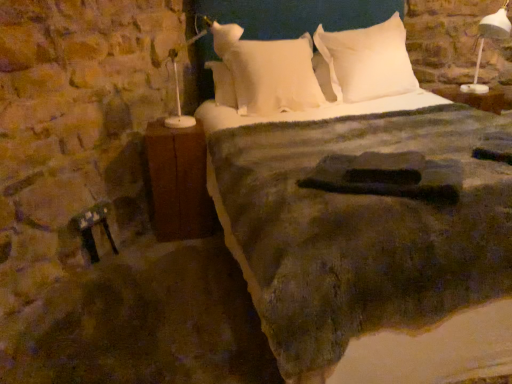
Question: Does white soft pillow at upper center, which is the 1th pillow in right-to-left order, have a greater width compared to white soft pillow at center, which is the 1th pillow in left-to-right order?

Choices:
 (A) yes
 (B) no

Answer: (B)

Question: Does white soft pillow at upper center, which is the 1th pillow in right-to-left order, lie in front of white soft pillow at center, which is the 1th pillow in left-to-right order?

Choices:
 (A) no
 (B) yes

Answer: (A)

Question: Is white soft pillow at upper center, the second pillow when ordered from left to right, next to white soft pillow at center, the 2th pillow positioned from the right?

Choices:
 (A) yes
 (B) no

Answer: (B)

Question: Is white soft pillow at upper center, the second pillow when ordered from left to right, facing towards white soft pillow at center, the 2th pillow positioned from the right?

Choices:
 (A) no
 (B) yes

Answer: (A)

Question: From the image's perspective, is white soft pillow at upper center, the second pillow when ordered from left to right, over white soft pillow at center, the 2th pillow positioned from the right?

Choices:
 (A) yes
 (B) no

Answer: (A)

Question: Considering the relative sizes of white soft pillow at upper center, the second pillow when ordered from left to right, and white soft pillow at center, the 2th pillow positioned from the right, in the image provided, is white soft pillow at upper center, the second pillow when ordered from left to right, taller than white soft pillow at center, the 2th pillow positioned from the right,?

Choices:
 (A) no
 (B) yes

Answer: (B)

Question: Does brown wood nightstand at left have a greater width compared to white plastic lamp at upper right?

Choices:
 (A) no
 (B) yes

Answer: (A)

Question: Does brown wood nightstand at left appear on the left side of white plastic lamp at upper right?

Choices:
 (A) no
 (B) yes

Answer: (B)

Question: Would you say brown wood nightstand at left contains white plastic lamp at upper right?

Choices:
 (A) no
 (B) yes

Answer: (A)

Question: Can you confirm if brown wood nightstand at left is thinner than white plastic lamp at upper right?

Choices:
 (A) no
 (B) yes

Answer: (B)

Question: Does brown wood nightstand at left come behind white plastic lamp at upper right?

Choices:
 (A) no
 (B) yes

Answer: (A)

Question: Is brown wood nightstand at left taller than white plastic lamp at upper right?

Choices:
 (A) no
 (B) yes

Answer: (B)

Question: Would you say brown wood nightstand at left is part of white soft pillow at upper center, the second pillow when ordered from left to right,'s contents?

Choices:
 (A) no
 (B) yes

Answer: (A)